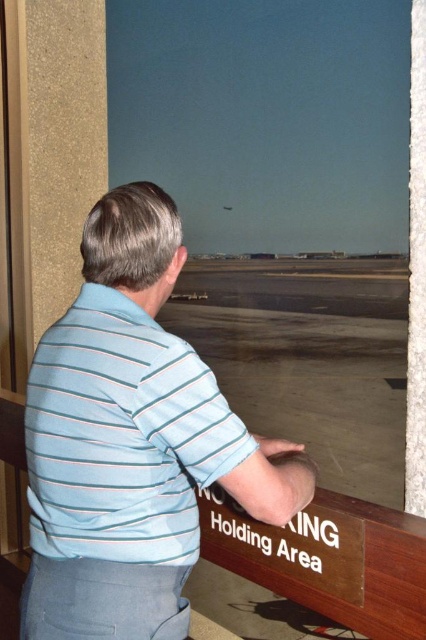
Question: Which point is farther to the camera?

Choices:
 (A) smooth concrete tarmac at center
 (B) light blue striped shirt at center

Answer: (A)

Question: Is light blue striped shirt at center to the right of smooth concrete tarmac at center from the viewer's perspective?

Choices:
 (A) no
 (B) yes

Answer: (A)

Question: Which object is farther from the camera taking this photo?

Choices:
 (A) light blue striped polo shirt at center
 (B) light blue striped shirt at center
 (C) smooth concrete tarmac at center

Answer: (C)

Question: Which object is farther from the camera taking this photo?

Choices:
 (A) light blue striped shirt at center
 (B) light blue striped polo shirt at center

Answer: (A)

Question: Can you confirm if light blue striped polo shirt at center is positioned above smooth concrete tarmac at center?

Choices:
 (A) yes
 (B) no

Answer: (A)

Question: Does light blue striped shirt at center have a greater width compared to smooth concrete tarmac at center?

Choices:
 (A) no
 (B) yes

Answer: (A)